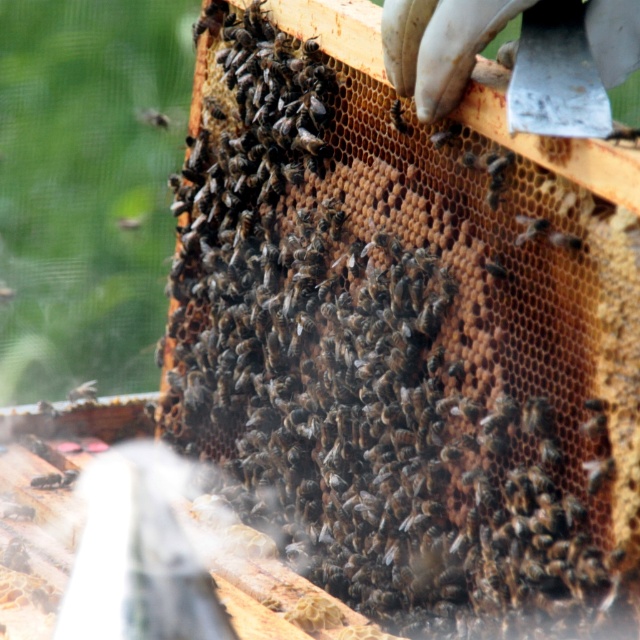
Between black fuzzy bee at center and black fuzzy bee at lower left, which one is positioned lower?

black fuzzy bee at center

Which is behind, point (81, 390) or point (45, 410)?

Positioned behind is point (81, 390).

Locate an element on the screen. The height and width of the screenshot is (640, 640). black fuzzy bee at center is located at coordinates (83, 392).